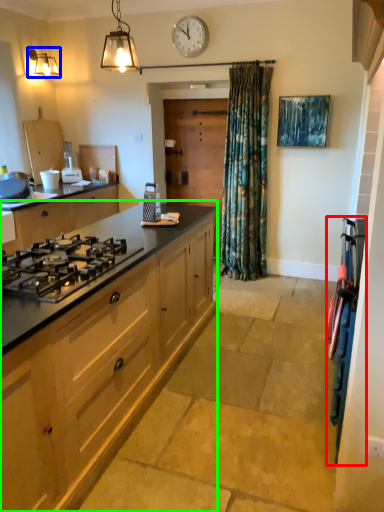
Question: Considering the real-world distances, which object is farthest from appliance (highlighted by a red box)? lamp (highlighted by a blue box) or cabinetry (highlighted by a green box)?

Choices:
 (A) lamp
 (B) cabinetry

Answer: (A)